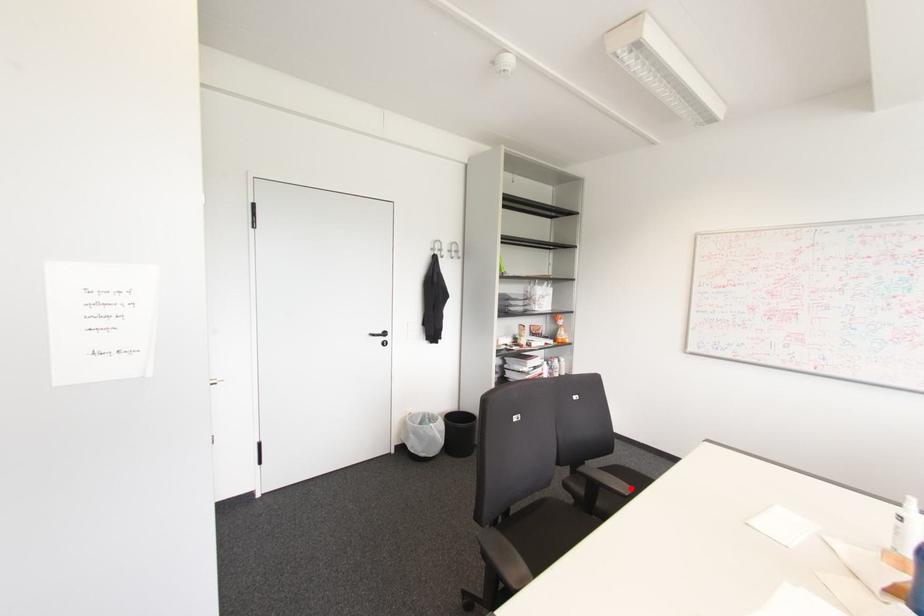
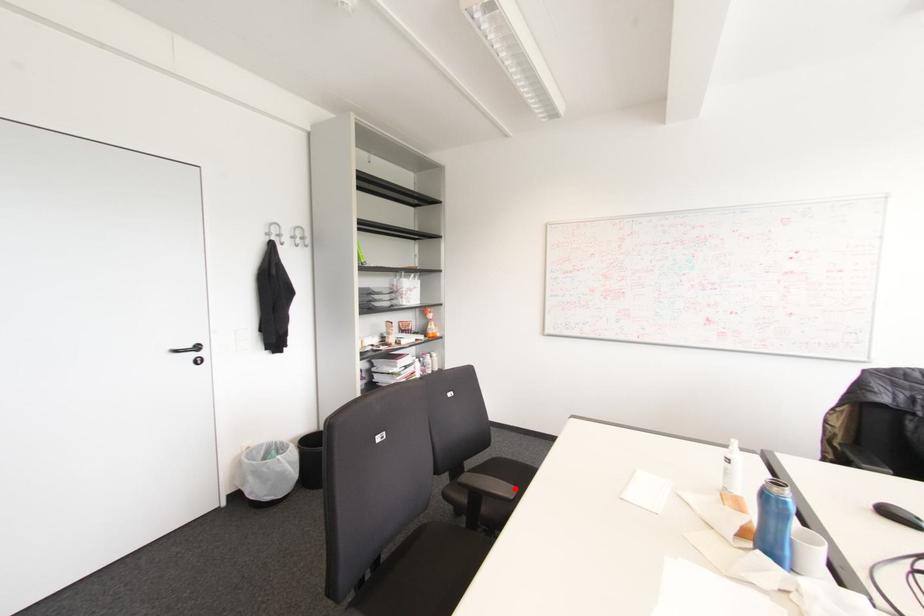
I am providing you with two images of the same scene from different viewpoints. A red point is marked on the first image and another point is marked on the second image. Are the points marked in image1 and image2 representing the same 3D position?

Yes